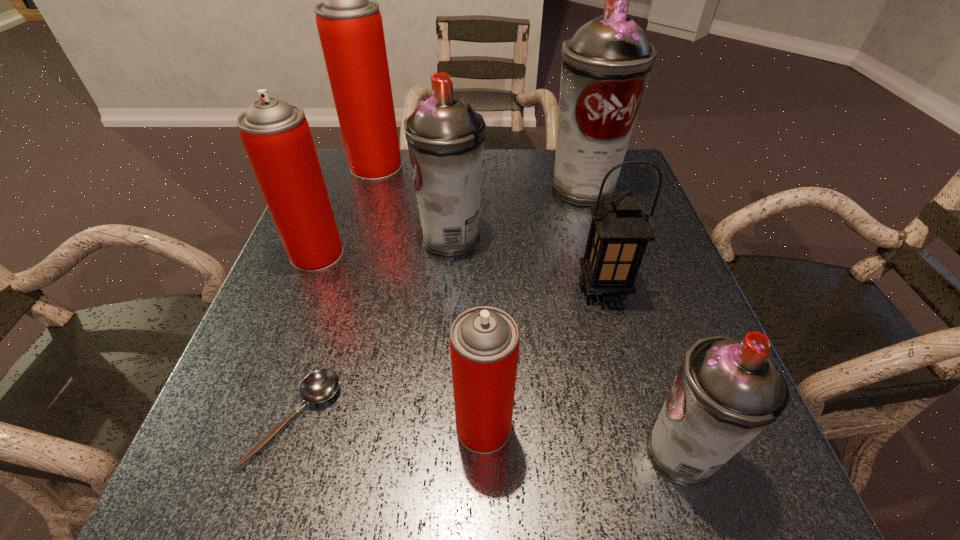
You are a GUI agent. You are given a task and a screenshot of the screen. Output one action in this format:
    pyautogui.click(x=<x>, y=<y>)
    Task: Click on the farthest red aerosol can
    This screenshot has height=540, width=960.
    Given the screenshot: What is the action you would take?
    click(x=349, y=22)

The height and width of the screenshot is (540, 960). I want to click on the farthest gray aerosol can, so click(606, 65).

You are a GUI agent. You are given a task and a screenshot of the screen. Output one action in this format:
    pyautogui.click(x=<x>, y=<y>)
    Task: Click on the second biggest red aerosol can
    This screenshot has width=960, height=540.
    Given the screenshot: What is the action you would take?
    pyautogui.click(x=276, y=135)

Locate an element on the screen. This screenshot has height=540, width=960. the leftmost gray aerosol can is located at coordinates (445, 136).

The height and width of the screenshot is (540, 960). I want to click on the second biggest gray aerosol can, so click(x=445, y=136).

You are a GUI agent. You are given a task and a screenshot of the screen. Output one action in this format:
    pyautogui.click(x=<x>, y=<y>)
    Task: Click on the black lantern
    
    Given the screenshot: What is the action you would take?
    pyautogui.click(x=619, y=233)

What are the coordinates of `the rightmost red aerosol can` in the screenshot? It's located at (484, 341).

At what (x,y) coordinates should I click in order to perform the action: click on the smallest red aerosol can. Please return your answer as a coordinate pair (x, y). Looking at the image, I should click on (484, 341).

Identify the location of the smallest gray aerosol can. click(x=727, y=391).

Find the location of `gray ladle`. gray ladle is located at coordinates (320, 385).